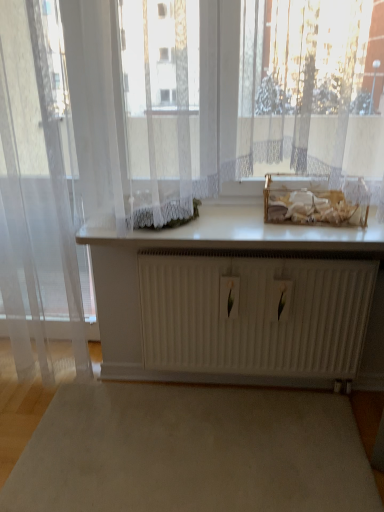
Question: From a real-world perspective, is transparent fabric curtain at left positioned over white glossy counter top at center based on gravity?

Choices:
 (A) yes
 (B) no

Answer: (A)

Question: Would you say transparent fabric curtain at left is outside white glossy counter top at center?

Choices:
 (A) no
 (B) yes

Answer: (B)

Question: From the image's perspective, would you say transparent fabric curtain at left is positioned over white glossy counter top at center?

Choices:
 (A) no
 (B) yes

Answer: (B)

Question: Would you say transparent fabric curtain at left contains white glossy counter top at center?

Choices:
 (A) no
 (B) yes

Answer: (A)

Question: Is transparent fabric curtain at left facing towards white glossy counter top at center?

Choices:
 (A) no
 (B) yes

Answer: (A)

Question: Considering the positions of point (291, 229) and point (142, 368), is point (291, 229) closer or farther from the camera than point (142, 368)?

Choices:
 (A) closer
 (B) farther

Answer: (A)

Question: Considering the relative positions of white glossy counter top at center and white matte radiator at center in the image provided, is white glossy counter top at center to the left or to the right of white matte radiator at center?

Choices:
 (A) left
 (B) right

Answer: (A)

Question: From a real-world perspective, is white glossy counter top at center above or below white matte radiator at center?

Choices:
 (A) above
 (B) below

Answer: (A)

Question: Which is correct: white glossy counter top at center is inside white matte radiator at center, or outside of it?

Choices:
 (A) inside
 (B) outside

Answer: (B)

Question: Does point (11, 289) appear closer or farther from the camera than point (89, 226)?

Choices:
 (A) closer
 (B) farther

Answer: (B)

Question: Based on their positions, is transparent fabric curtain at left located to the left or right of white glossy counter top at center?

Choices:
 (A) left
 (B) right

Answer: (A)

Question: From a real-world perspective, is transparent fabric curtain at left above or below white glossy counter top at center?

Choices:
 (A) above
 (B) below

Answer: (A)

Question: Choose the correct answer: Is transparent fabric curtain at left inside white glossy counter top at center or outside it?

Choices:
 (A) inside
 (B) outside

Answer: (B)

Question: From the image's perspective, relative to white glossy counter top at center, is beige carpet at center above or below?

Choices:
 (A) below
 (B) above

Answer: (A)

Question: Is beige carpet at center wider or thinner than white glossy counter top at center?

Choices:
 (A) thin
 (B) wide

Answer: (B)